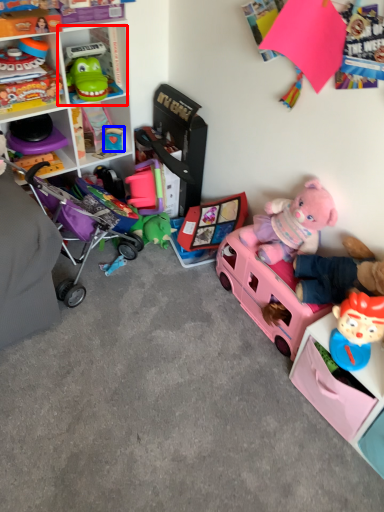
Question: Which object is closer to the camera taking this photo, cabinet (highlighted by a red box) or toy (highlighted by a blue box)?

Choices:
 (A) cabinet
 (B) toy

Answer: (A)